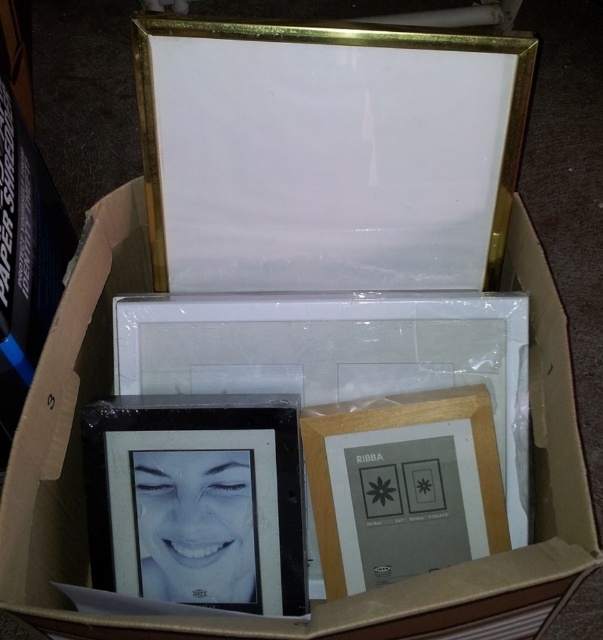
Question: From the image, what is the correct spatial relationship of matte white cardboard box at center in relation to black glossy photo frame at lower left?

Choices:
 (A) above
 (B) below

Answer: (A)

Question: Is matte white cardboard box at center in front of black glossy photo frame at lower left?

Choices:
 (A) no
 (B) yes

Answer: (B)

Question: Is matte white cardboard box at center behind black glossy photo frame at lower left?

Choices:
 (A) yes
 (B) no

Answer: (B)

Question: Which of the following is the farthest from the observer?

Choices:
 (A) matte white cardboard box at center
 (B) black glossy photo frame at lower left

Answer: (B)

Question: Among these points, which one is nearest to the camera?

Choices:
 (A) (543, 477)
 (B) (127, 397)

Answer: (B)

Question: Which of the following is the closest to the observer?

Choices:
 (A) (572, 408)
 (B) (279, 467)

Answer: (A)